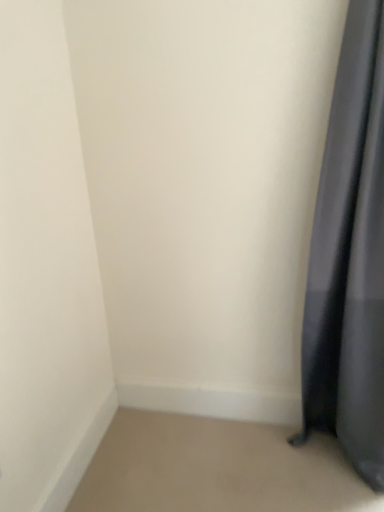
Describe the element at coordinates (350, 258) in the screenshot. The width and height of the screenshot is (384, 512). I see `dark gray fabric curtain at right` at that location.

Measure the distance between point (310, 426) and camera.

The depth of point (310, 426) is 6.32 feet.

Find the location of a particular element. The height and width of the screenshot is (512, 384). dark gray fabric curtain at right is located at coordinates (350, 258).

Identify the location of dark gray fabric curtain at right. This screenshot has height=512, width=384. click(350, 258).